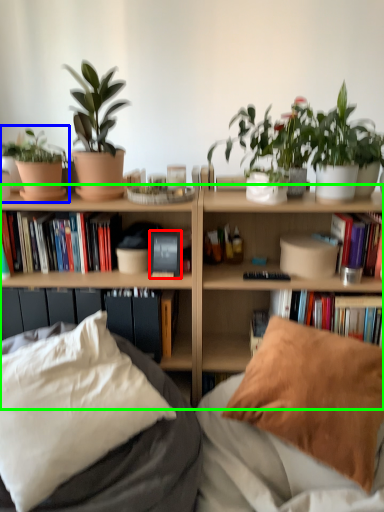
Question: Which object is positioned farthest from paperback book (highlighted by a red box)? Select from houseplant (highlighted by a blue box) and bookcase (highlighted by a green box).

Choices:
 (A) houseplant
 (B) bookcase

Answer: (A)